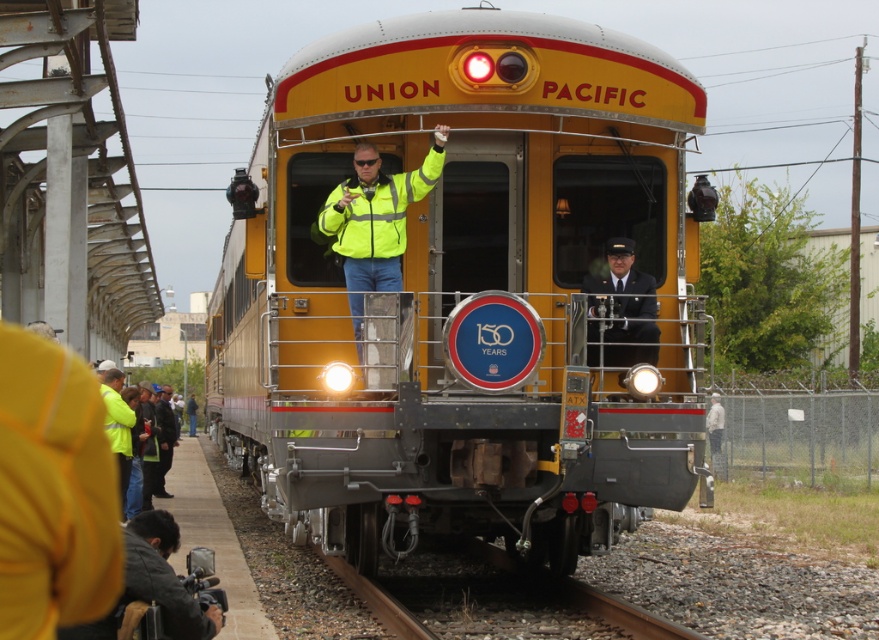
Can you confirm if dark gray fabric camera at lower left is taller than dark blue uniform at center?

In fact, dark gray fabric camera at lower left may be shorter than dark blue uniform at center.

Can you confirm if dark gray fabric camera at lower left is positioned to the left of dark blue uniform at center?

Yes, dark gray fabric camera at lower left is to the left of dark blue uniform at center.

Which is in front, point (182, 602) or point (623, 333)?

Point (182, 602)

You are a GUI agent. You are given a task and a screenshot of the screen. Output one action in this format:
    pyautogui.click(x=<x>, y=<y>)
    Task: Click on the dark gray fabric camera at lower left
    
    Given the screenshot: What is the action you would take?
    pyautogui.click(x=164, y=579)

Between neon yellow reflective jacket at center and dark gray fabric camera at lower left, which one appears on the left side from the viewer's perspective?

dark gray fabric camera at lower left is more to the left.

What do you see at coordinates (375, 225) in the screenshot?
I see `neon yellow reflective jacket at center` at bounding box center [375, 225].

Where is `neon yellow reflective jacket at center`? neon yellow reflective jacket at center is located at coordinates (375, 225).

Which is in front, point (304, 230) or point (628, 332)?

Point (628, 332)

What are the coordinates of `yellow polished metal train at center` in the screenshot? It's located at (461, 289).